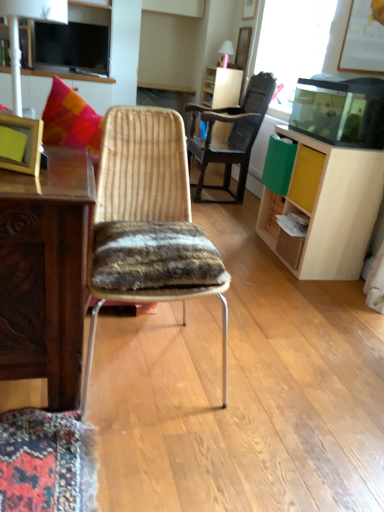
Identify the location of vacant area in front of light wood cabinet at right. (301, 291).